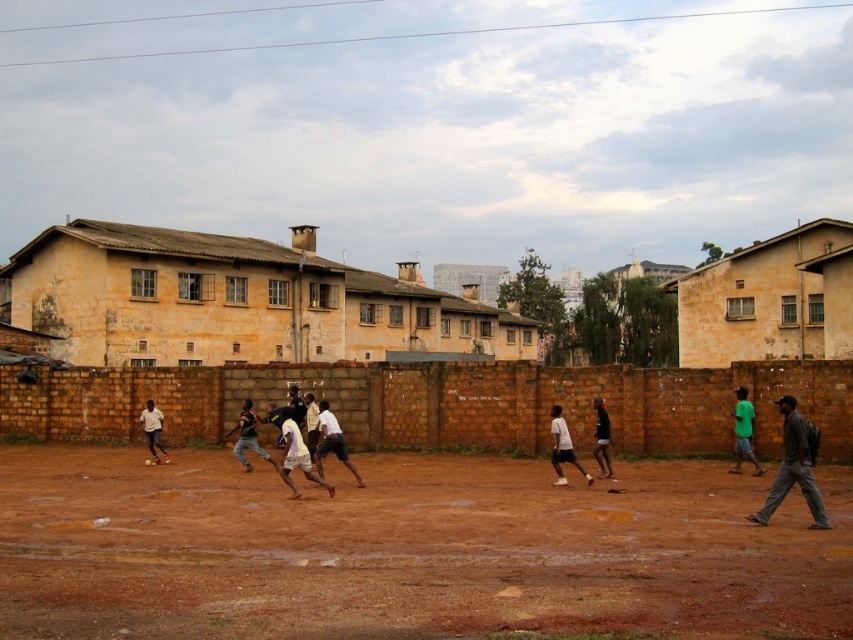
Question: In this image, where is dark gray fabric backpack at lower right located relative to white matte shirt at center?

Choices:
 (A) above
 (B) below

Answer: (A)

Question: Which of the following is the farthest from the observer?

Choices:
 (A) dark gray fabric backpack at lower right
 (B) brown dirt field at center
 (C) white matte shirt at center

Answer: (C)

Question: Is brown dirt field at center in front of white matte shirt at center?

Choices:
 (A) yes
 (B) no

Answer: (A)

Question: Which of these objects is positioned closest to the dark gray fabric backpack at lower right?

Choices:
 (A) white matte shirt at center
 (B) brown dirt field at center

Answer: (A)

Question: Observing the image, what is the correct spatial positioning of brown dirt field at center in reference to dark gray fabric backpack at lower right?

Choices:
 (A) below
 (B) above

Answer: (A)

Question: Which point is farther to the camera?

Choices:
 (A) dark gray fabric backpack at lower right
 (B) brown dirt field at center
 (C) white matte shirt at center

Answer: (C)